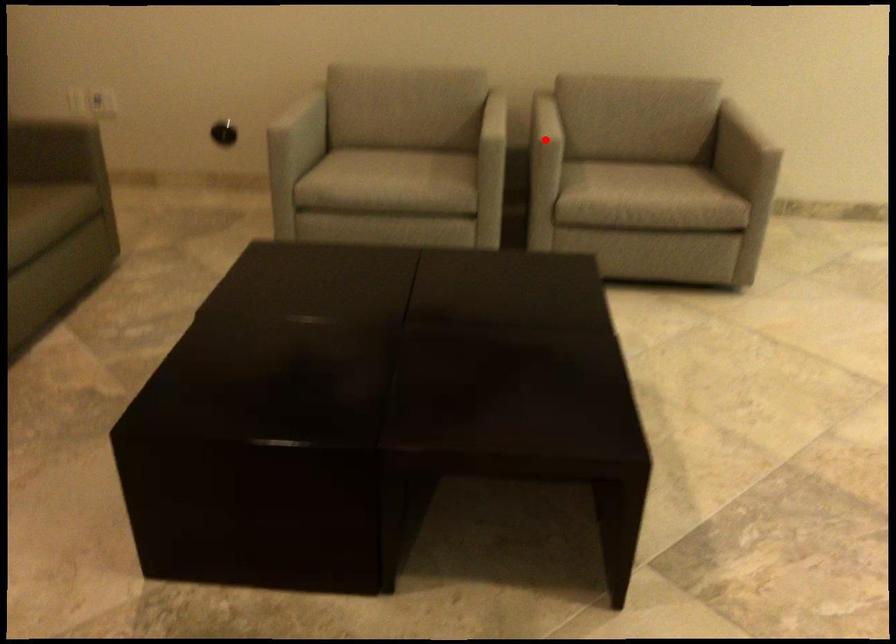
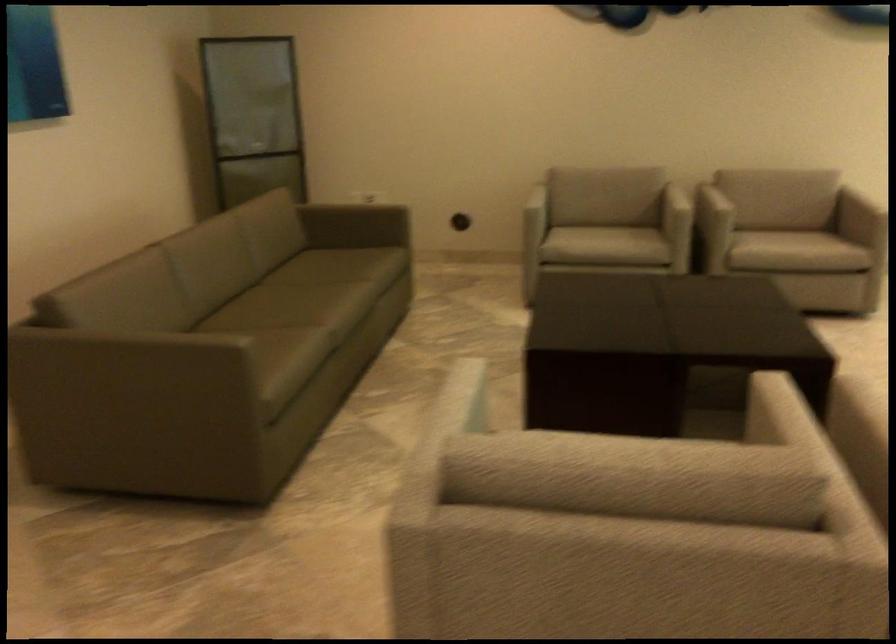
Find the pixel in the second image that matches the highlighted location in the first image.

(719, 205)